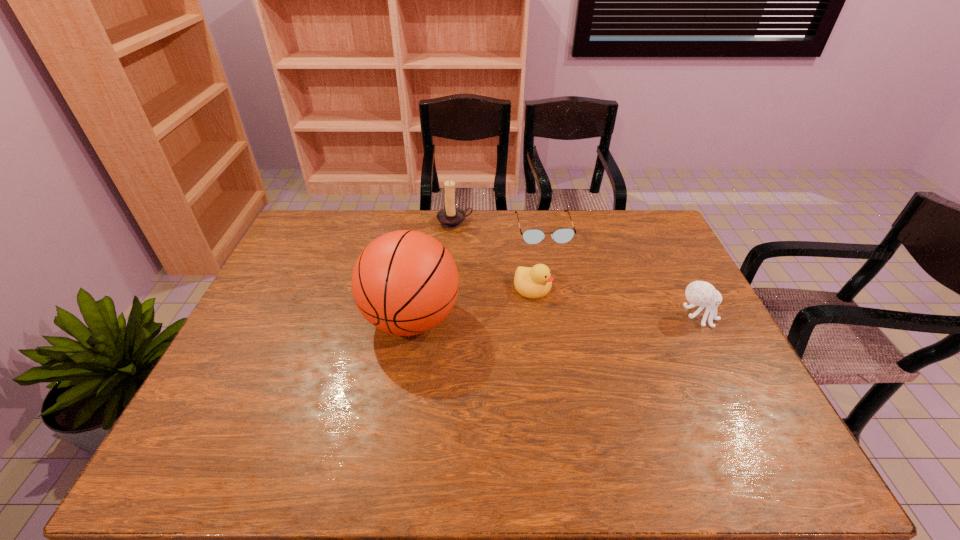
Find the location of a particular element. The image size is (960, 540). the tallest object is located at coordinates (405, 282).

Where is `the third shortest object`? The image size is (960, 540). the third shortest object is located at coordinates (698, 293).

At what (x,y) coordinates should I click in order to perform the action: click on the rightmost object. Please return your answer as a coordinate pair (x, y). Looking at the image, I should click on (698, 293).

Where is `the fourth tallest object`? Image resolution: width=960 pixels, height=540 pixels. the fourth tallest object is located at coordinates tap(535, 282).

Find the location of a particular element. Image resolution: width=960 pixels, height=540 pixels. the shortest object is located at coordinates (531, 236).

Identify the location of the second tallest object. This screenshot has width=960, height=540. (450, 217).

Locate an element on the screen. vacant region located 0.280m on the back of the basketball is located at coordinates (425, 234).

This screenshot has width=960, height=540. I want to click on vacant space located on the face of the second shortest object, so click(x=646, y=345).

You are a GUI agent. You are given a task and a screenshot of the screen. Output one action in this format:
    pyautogui.click(x=<x>, y=<y>)
    Task: Click on the blank area located on the face of the second shortest object
    This screenshot has height=540, width=960.
    Given the screenshot: What is the action you would take?
    pyautogui.click(x=668, y=355)

Locate an element on the screen. The height and width of the screenshot is (540, 960). free point located on the face of the second shortest object is located at coordinates (622, 332).